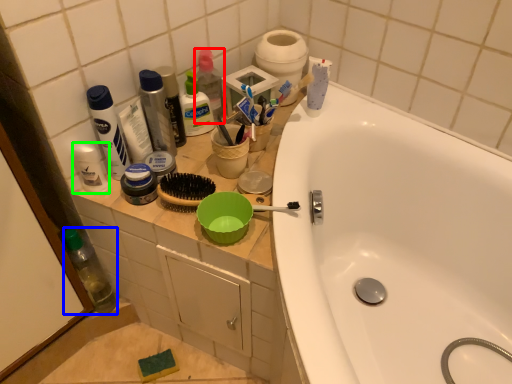
Question: Based on their relative distances, which object is nearer to toiletry (highlighted by a red box)? Choose from bottle (highlighted by a blue box) and toiletry (highlighted by a green box).

Choices:
 (A) bottle
 (B) toiletry

Answer: (B)